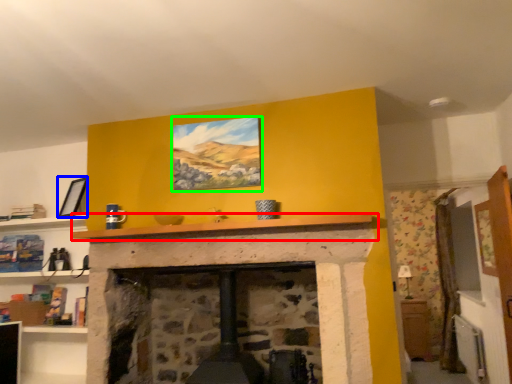
Question: Which object is the farthest from mantle (highlighted by a red box)? Choose among these: picture frame (highlighted by a blue box) or picture frame (highlighted by a green box).

Choices:
 (A) picture frame
 (B) picture frame

Answer: (A)